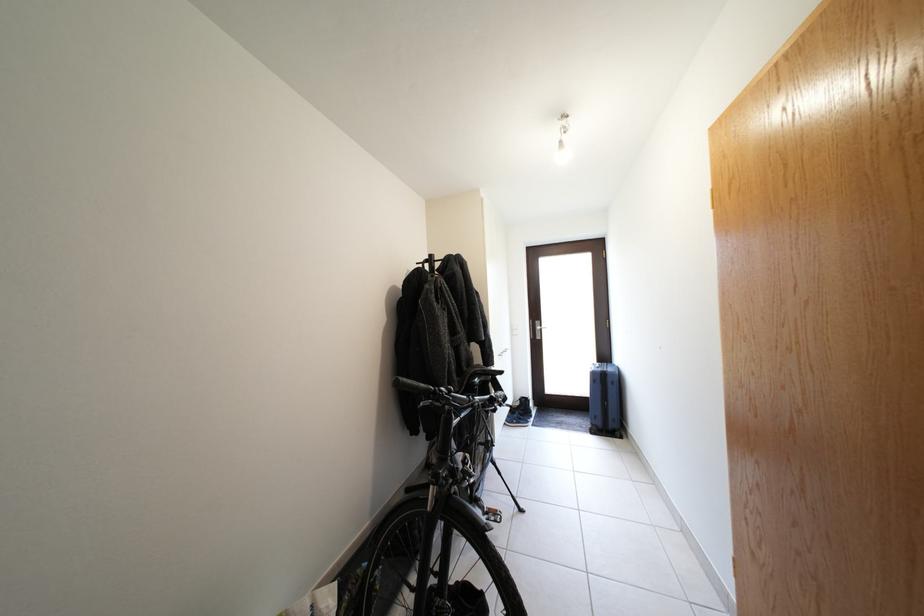
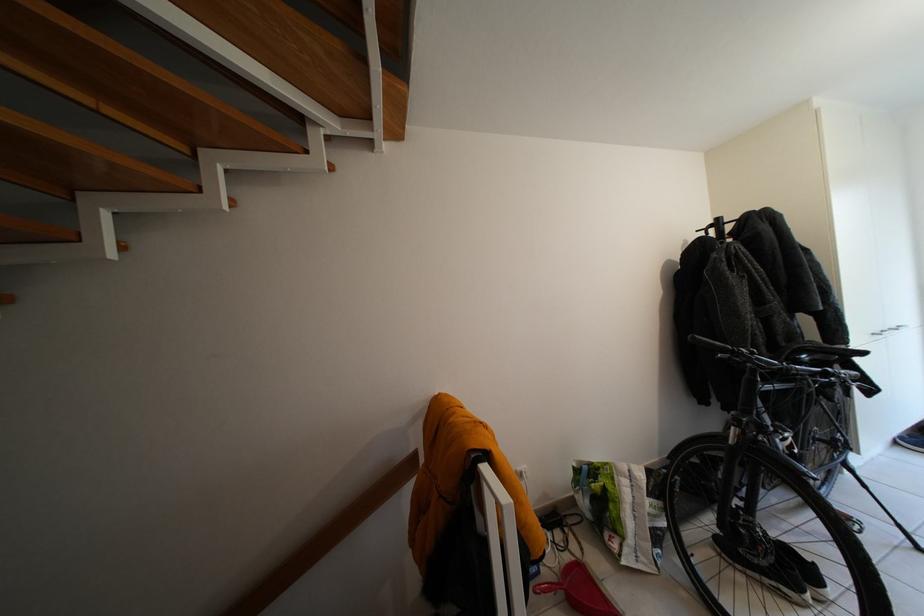
Where in the second image is the point corresponding to [496,379] from the first image?

(841, 360)